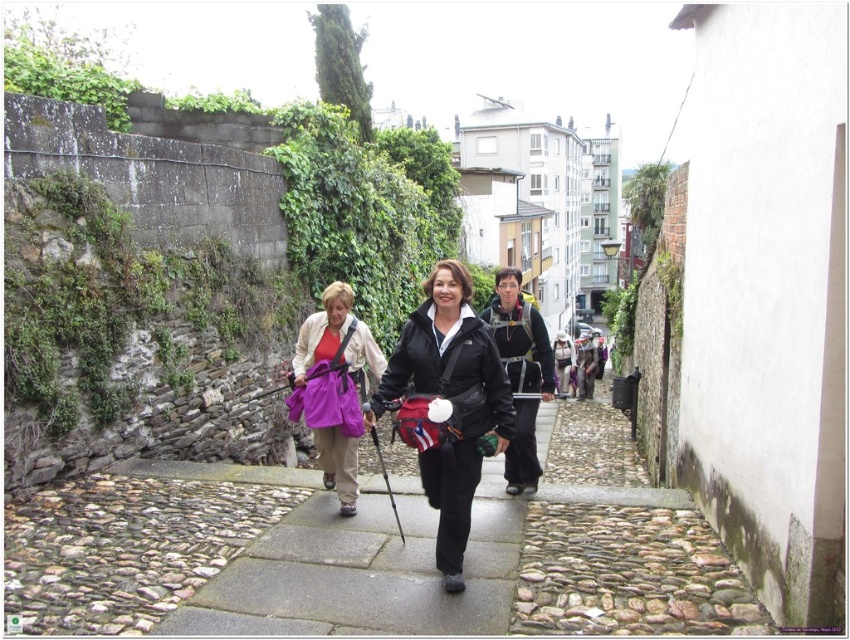
Question: Where is black matte jacket at center located in relation to matte purple backpack at center in the image?

Choices:
 (A) left
 (B) right

Answer: (B)

Question: Which point is closer to the camera?

Choices:
 (A) (347, 344)
 (B) (422, 316)

Answer: (B)

Question: Is the position of black matte jacket at center more distant than that of matte purple backpack at center?

Choices:
 (A) yes
 (B) no

Answer: (B)

Question: Is black matte jacket at center further to camera compared to matte purple backpack at center?

Choices:
 (A) yes
 (B) no

Answer: (B)

Question: Which point appears farthest from the camera in this image?

Choices:
 (A) (374, 376)
 (B) (452, 548)

Answer: (A)